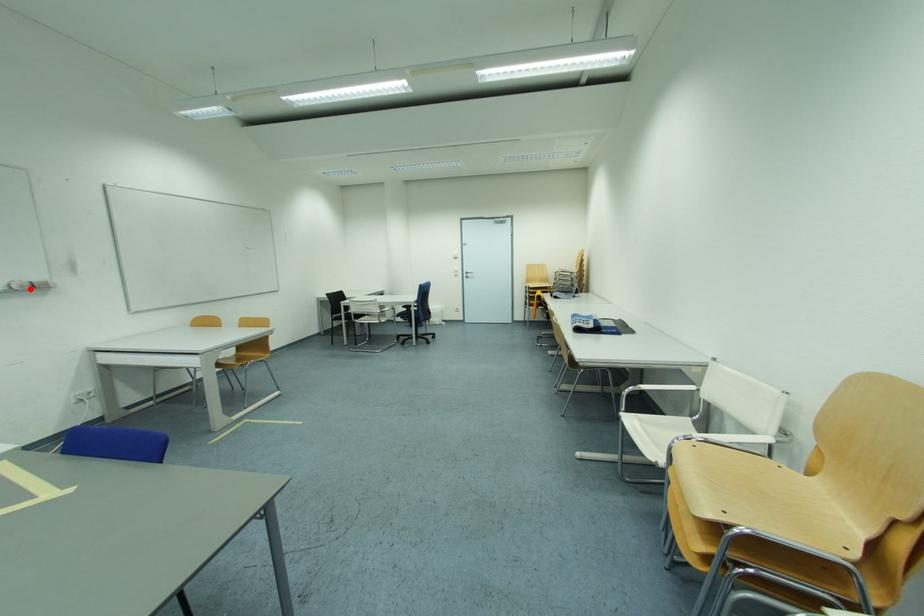
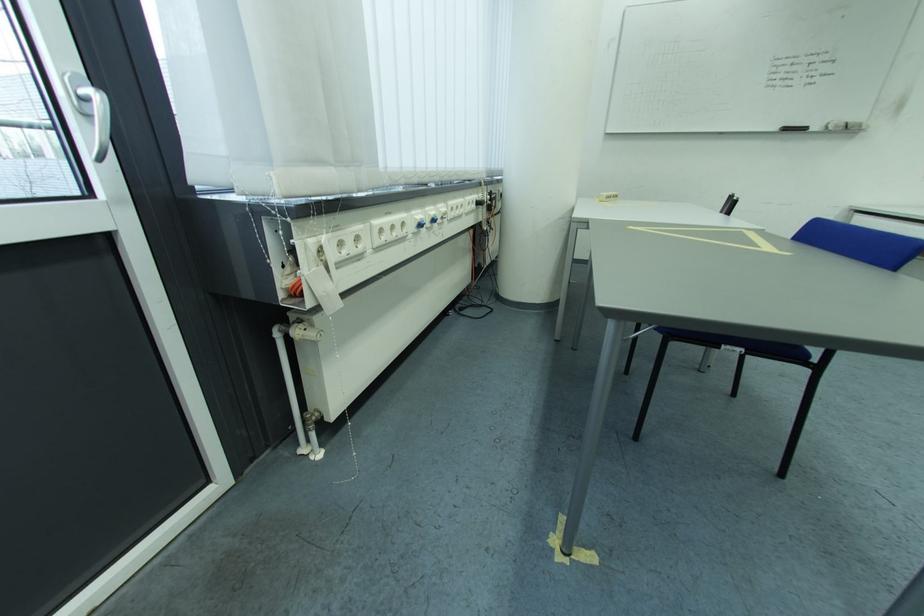
Question: I am providing you with two images of the same scene from different viewpoints. In image1, a red point is highlighted. Considering the same 3D point in image2, which of the following is correct?

Choices:
 (A) It is closer
 (B) It is farther

Answer: (B)